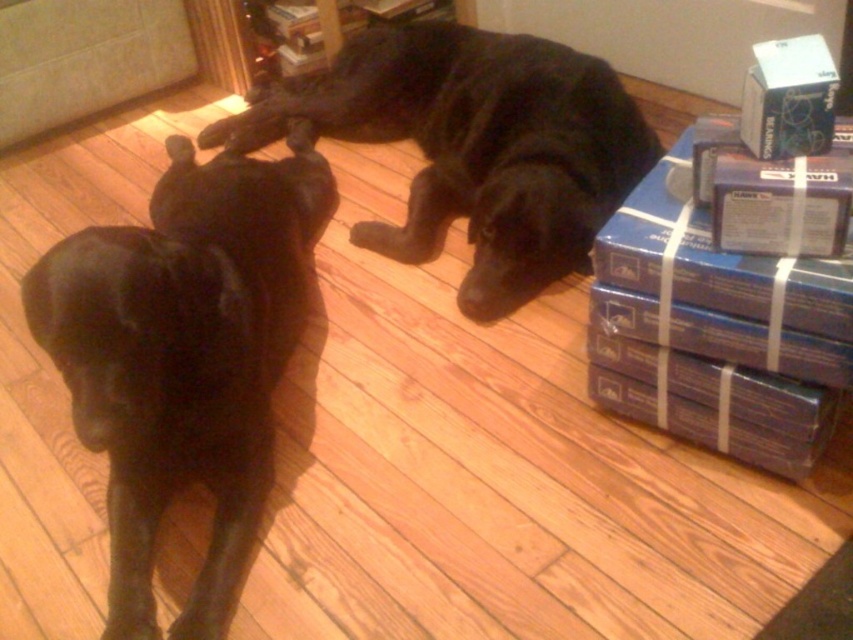
You are standing in the room where the two black dogs are. You want to place a small treat between the two points marked as point (270, 204) and point (477, 120). Which point is closer to you so you can drop the treat there first?

Point (270, 204) is closer to the camera than point (477, 120), so you can drop the treat there first.

In the scene shown: You are a drone operator trying to capture a photo of the shiny black dog at left. The drone is currently hovering at point 0.5, 0.2. Should you adjust the drone to move north or south to align with the dog?

The shiny black dog at left is located at point (184, 356). Since the drone is at (170, 320), it needs to move north to increase the y coordinate from 0.2 to 0.217. Therefore, adjust the drone to move north.